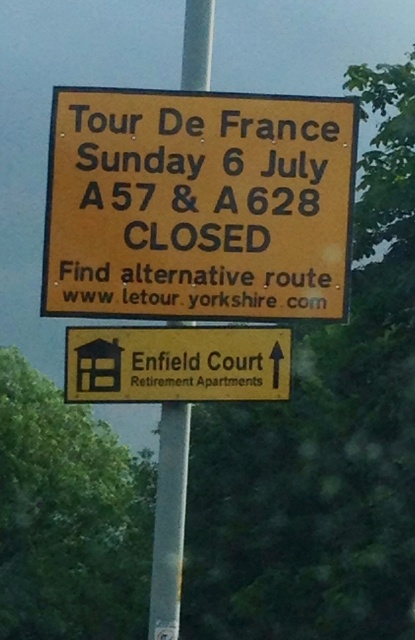
Question: Can you confirm if yellow matte sign at upper center is wider than silver metallic pole at center?

Choices:
 (A) no
 (B) yes

Answer: (B)

Question: Among these objects, which one is farthest from the camera?

Choices:
 (A) yellow matte sign at upper center
 (B) silver metallic pole at center

Answer: (B)

Question: Can you confirm if yellow matte sign at upper center is smaller than silver metallic pole at center?

Choices:
 (A) yes
 (B) no

Answer: (B)

Question: Does yellow matte sign at upper center have a smaller size compared to silver metallic pole at center?

Choices:
 (A) yes
 (B) no

Answer: (B)

Question: Which of the following is the closest to the observer?

Choices:
 (A) silver metallic pole at center
 (B) yellow matte sign at upper center

Answer: (B)